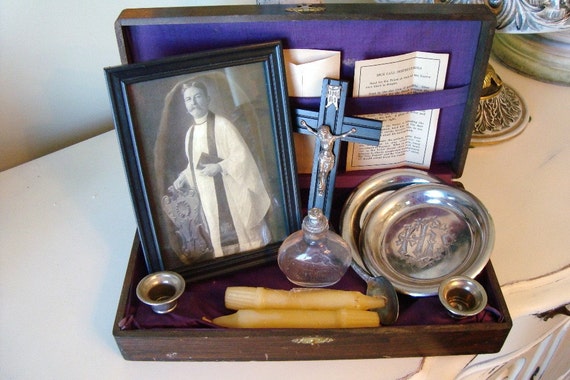
You are a GUI agent. You are given a task and a screenshot of the screen. Output one action in this format:
    pyautogui.click(x=<x>, y=<y>)
    Task: Click on the white robe
    
    Given the screenshot: What is the action you would take?
    pyautogui.click(x=247, y=169)